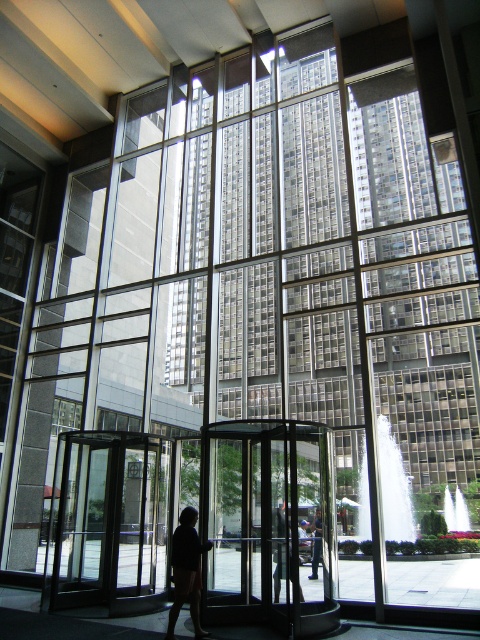
Does dark fabric jacket at center appear on the right side of dark blue jeans at center?

No, dark fabric jacket at center is not to the right of dark blue jeans at center.

Who is more forward, (172,621) or (319,547)?

Point (172,621) is in front.

Find the location of a particular element. dark fabric jacket at center is located at coordinates (187, 570).

Who is more forward, (276, 470) or (107, 545)?

Point (107, 545) is in front.

Does transparent glass door at center appear on the right side of transparent glass door at left?

Correct, you'll find transparent glass door at center to the right of transparent glass door at left.

This screenshot has height=640, width=480. What are the coordinates of `transparent glass door at center` in the screenshot? It's located at (268, 524).

What do you see at coordinates (187, 570) in the screenshot? The height and width of the screenshot is (640, 480). I see `dark fabric jacket at center` at bounding box center [187, 570].

Is dark fabric jacket at center above black fabric person at center?

Correct, dark fabric jacket at center is located above black fabric person at center.

Does point (192, 536) lie behind point (274, 556)?

No, (192, 536) is closer to viewer.

Identify the location of dark fabric jacket at center. The image size is (480, 640). (187, 570).